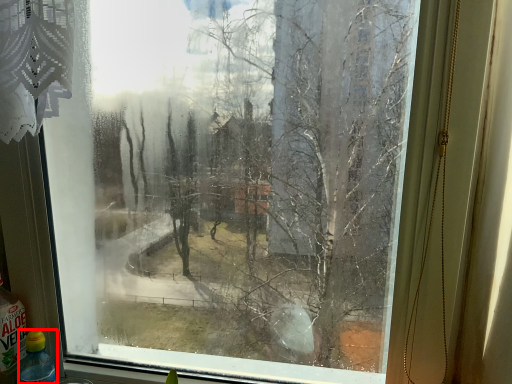
Question: Observing the image, what is the correct spatial positioning of bottle (annotated by the red box) in reference to bottle?

Choices:
 (A) right
 (B) left

Answer: (A)